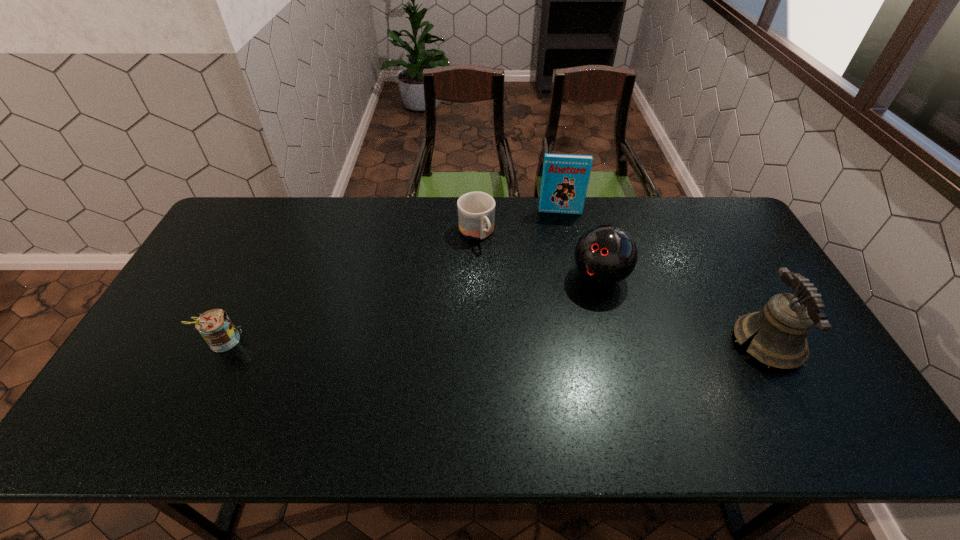
I want to click on vacant space located on the side with the handle of the fourth object from right to left, so click(x=494, y=264).

In order to click on vacant region located 0.290m on the side with the handle of the fourth object from right to left in this screenshot , I will do `click(526, 310)`.

Identify the location of free location located 0.240m on the front cover of the book. Image resolution: width=960 pixels, height=540 pixels. click(562, 261).

What are the coordinates of `vacant space located 0.380m on the front cover of the book` in the screenshot? It's located at (564, 294).

Identify the location of free location located on the front cover of the book. Image resolution: width=960 pixels, height=540 pixels. (560, 235).

You are a GUI agent. You are given a task and a screenshot of the screen. Output one action in this format:
    pyautogui.click(x=<x>, y=<y>)
    Task: Click on the free space located 0.060m on the surface of the bowling ball near the finger holes
    
    Given the screenshot: What is the action you would take?
    pyautogui.click(x=574, y=306)

At what (x,y) coordinates should I click in order to perform the action: click on vacant point located on the surface of the bowling ball near the finger holes. Please return your answer as a coordinate pair (x, y). Looking at the image, I should click on (541, 343).

Locate an element on the screen. free point located on the surface of the bowling ball near the finger holes is located at coordinates (522, 366).

You are a GUI agent. You are given a task and a screenshot of the screen. Output one action in this format:
    pyautogui.click(x=<x>, y=<y>)
    Task: Click on the mug that is at the far edge
    Image resolution: width=960 pixels, height=540 pixels.
    Given the screenshot: What is the action you would take?
    pyautogui.click(x=476, y=210)

Identify the location of book positioned at the far edge. (565, 178).